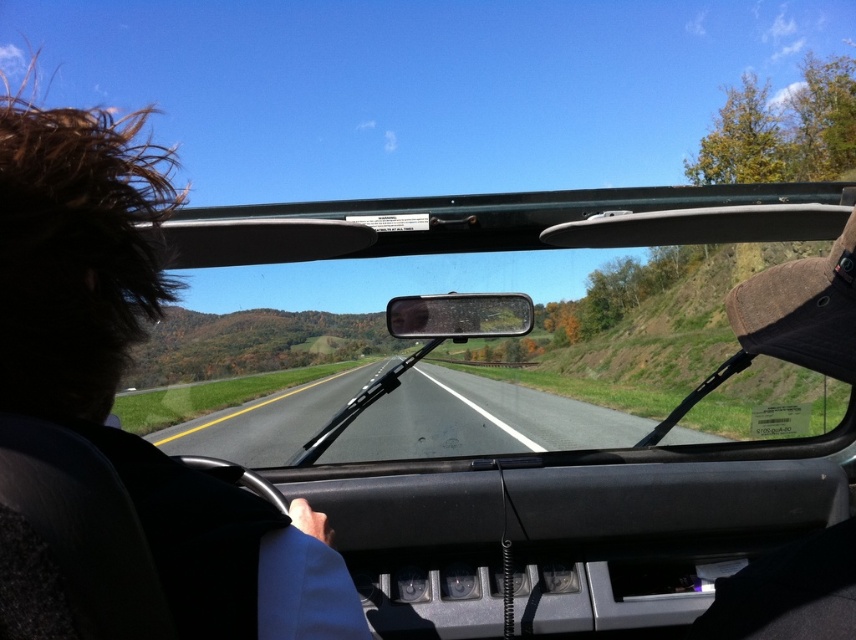
Is brown hair at upper left to the left of asphalt road at center from the viewer's perspective?

Indeed, brown hair at upper left is positioned on the left side of asphalt road at center.

Based on the photo, is brown hair at upper left smaller than asphalt road at center?

Actually, brown hair at upper left might be larger than asphalt road at center.

Where is `brown hair at upper left`? This screenshot has height=640, width=856. brown hair at upper left is located at coordinates (125, 365).

Where is `brown hair at upper left`? brown hair at upper left is located at coordinates (125, 365).

Can you confirm if transparent glass windshield at center is positioned to the right of brown hair at upper left?

Indeed, transparent glass windshield at center is positioned on the right side of brown hair at upper left.

Between transparent glass windshield at center and brown hair at upper left, which one is positioned lower?

Positioned lower is transparent glass windshield at center.

Find the location of a particular element. The image size is (856, 640). transparent glass windshield at center is located at coordinates (566, 385).

At what (x,y) coordinates should I click in order to perform the action: click on transparent glass windshield at center. Please return your answer as a coordinate pair (x, y). The width and height of the screenshot is (856, 640). Looking at the image, I should click on (566, 385).

Is point (449, 442) closer to viewer compared to point (423, 365)?

That is True.

Is transparent glass windshield at center positioned before asphalt road at center?

That is True.

This screenshot has height=640, width=856. I want to click on transparent glass windshield at center, so click(x=566, y=385).

The height and width of the screenshot is (640, 856). Identify the location of transparent glass windshield at center. (566, 385).